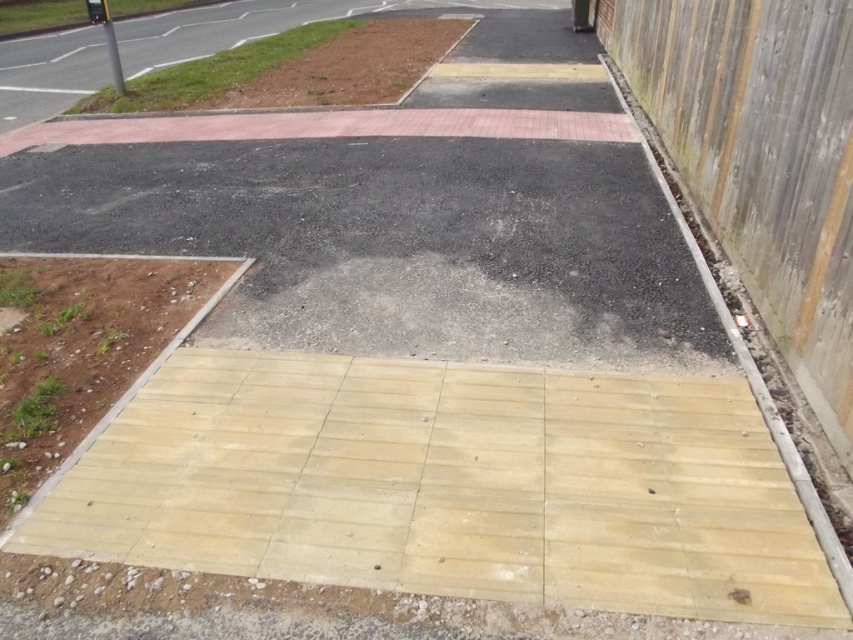
Question: In this image, where is smooth yellow concrete at center located relative to wooden at right?

Choices:
 (A) left
 (B) right

Answer: (A)

Question: Which point appears farthest from the camera in this image?

Choices:
 (A) (785, 451)
 (B) (373, 404)

Answer: (B)

Question: Which of the following is the farthest from the observer?

Choices:
 (A) (604, 64)
 (B) (637, 588)

Answer: (A)

Question: In this image, where is smooth yellow concrete at center located relative to wooden at right?

Choices:
 (A) right
 (B) left

Answer: (B)

Question: Is smooth yellow concrete at center wider than wooden at right?

Choices:
 (A) yes
 (B) no

Answer: (A)

Question: Which of the following is the farthest from the observer?

Choices:
 (A) (757, 392)
 (B) (601, 513)

Answer: (A)